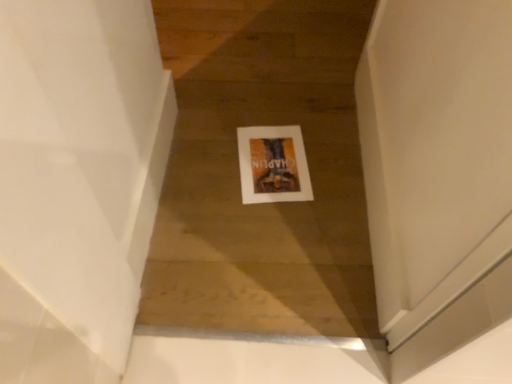
Question: Considering the positions of point (71, 332) and point (266, 201), is point (71, 332) closer or farther from the camera than point (266, 201)?

Choices:
 (A) farther
 (B) closer

Answer: (B)

Question: From a real-world perspective, relative to white matte picture frame at center, is white glossy wall at upper left vertically above or below?

Choices:
 (A) below
 (B) above

Answer: (B)

Question: Looking at the image, does white glossy wall at upper left seem bigger or smaller compared to white matte picture frame at center?

Choices:
 (A) big
 (B) small

Answer: (A)

Question: Considering their positions, is white matte picture frame at center located in front of or behind white glossy wall at upper left?

Choices:
 (A) front
 (B) behind

Answer: (B)

Question: Considering the positions of white matte picture frame at center and white glossy wall at upper left in the image, is white matte picture frame at center taller or shorter than white glossy wall at upper left?

Choices:
 (A) tall
 (B) short

Answer: (B)

Question: Does point (282, 170) appear closer or farther from the camera than point (87, 362)?

Choices:
 (A) farther
 (B) closer

Answer: (A)

Question: From a real-world perspective, relative to white glossy wall at upper left, is white matte picture frame at center vertically above or below?

Choices:
 (A) above
 (B) below

Answer: (B)